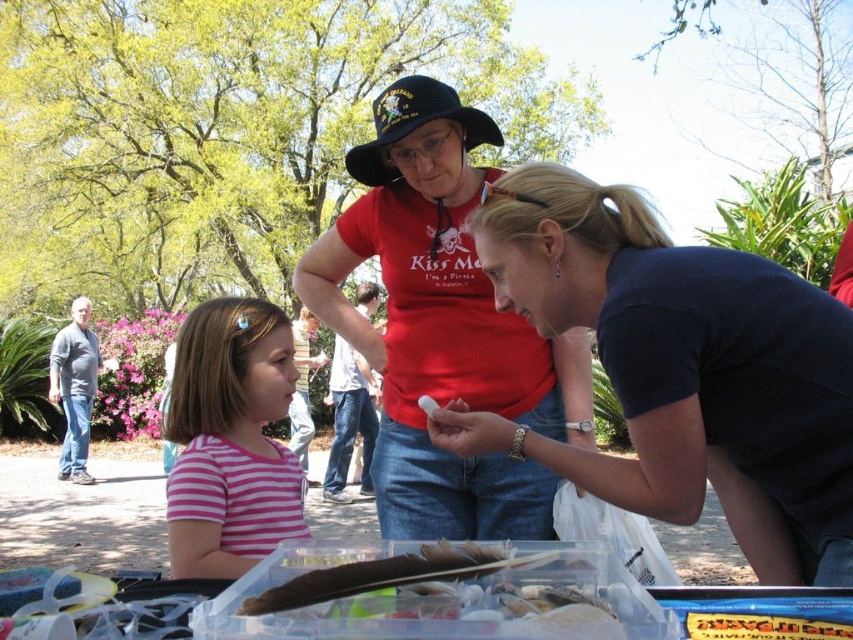
Does dark blue shirt at center have a greater height compared to pink striped shirt at center?

Yes, dark blue shirt at center is taller than pink striped shirt at center.

Is dark blue shirt at center positioned behind pink striped shirt at center?

No, dark blue shirt at center is in front of pink striped shirt at center.

Identify the location of dark blue shirt at center. Image resolution: width=853 pixels, height=640 pixels. (680, 371).

From the picture: Can you confirm if dark blue shirt at center is positioned to the right of matte red shirt at center?

Correct, you'll find dark blue shirt at center to the right of matte red shirt at center.

Is point (730, 378) positioned in front of point (482, 346)?

Yes, point (730, 378) is in front of point (482, 346).

You are a GUI agent. You are given a task and a screenshot of the screen. Output one action in this format:
    pyautogui.click(x=<x>, y=<y>)
    Task: Click on the dark blue shirt at center
    Image resolution: width=853 pixels, height=640 pixels.
    Given the screenshot: What is the action you would take?
    [680, 371]

I want to click on matte red shirt at center, so click(442, 326).

Which of these two, matte red shirt at center or pink striped shirt at center, stands taller?

With more height is matte red shirt at center.

Does point (543, 518) come farther from viewer compared to point (294, 461)?

No, it is not.

Identify the location of matte red shirt at center. This screenshot has width=853, height=640. (442, 326).